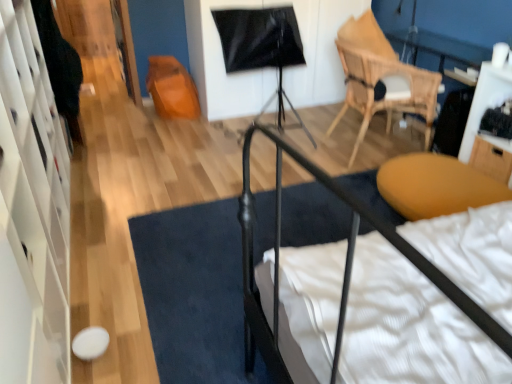
Locate an element on the screen. free spot below natural wood chair at upper right (from a real-world perspective) is located at coordinates (369, 148).